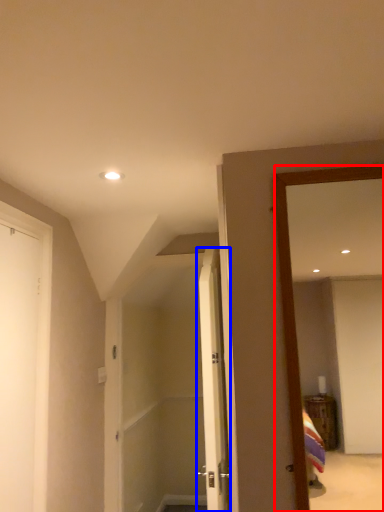
Question: Which point is further to the camera, mirror (highlighted by a red box) or door (highlighted by a blue box)?

Choices:
 (A) mirror
 (B) door

Answer: (B)